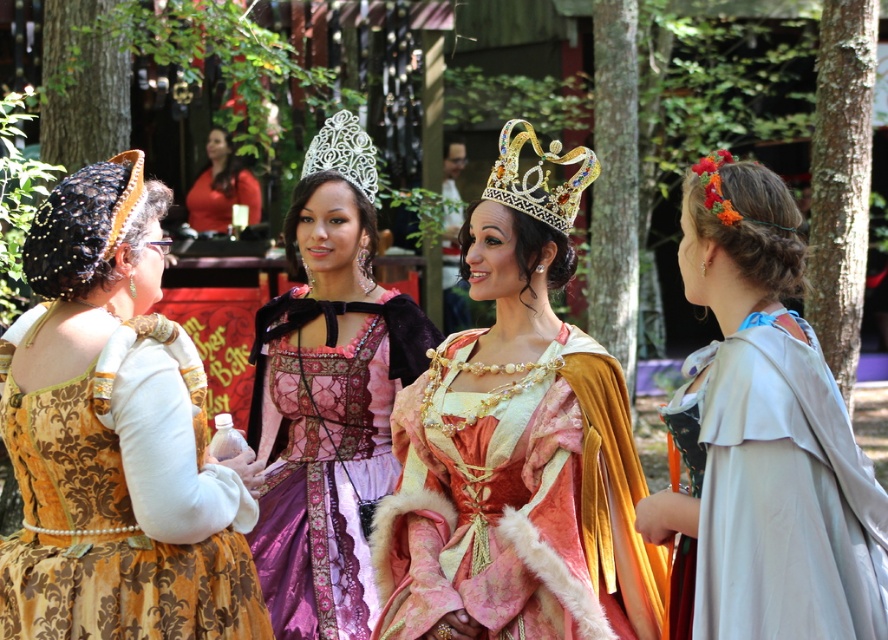
You are standing at the point labeled point (153, 449) and want to move towards the point labeled point (320, 129). Which direction should you face to walk towards it?

Since point (153, 449) is closer to the viewer than point (320, 129), you should face away from the viewer to walk towards point (320, 129).

You are a photographer at the Renaissance fair and want to capture a photo of the gold jeweled crown at center and the matte red dress at upper center. Which object is closer to the camera?

The gold jeweled crown at center is shorter than the matte red dress at upper center, so the crown is closer to the camera because it appears smaller in height compared to the dress.